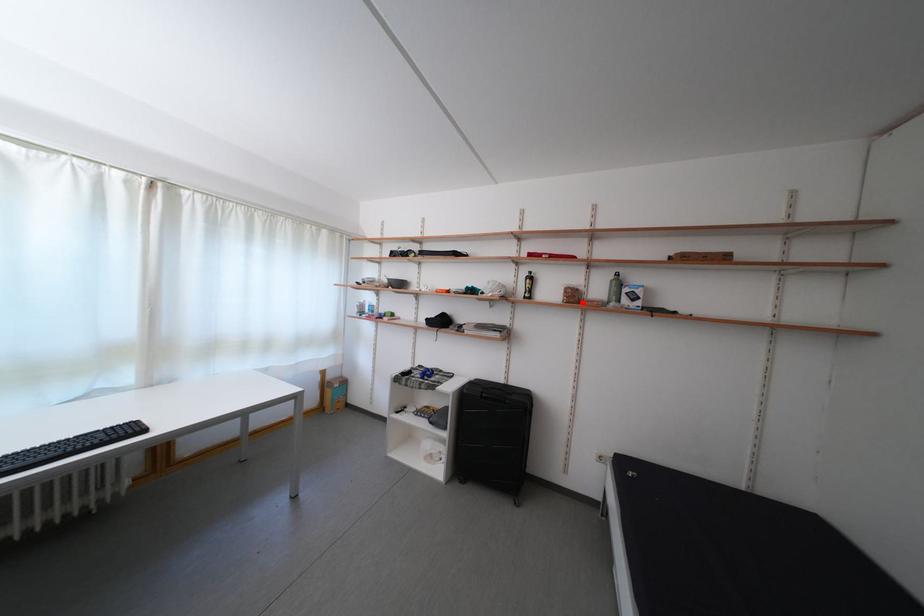
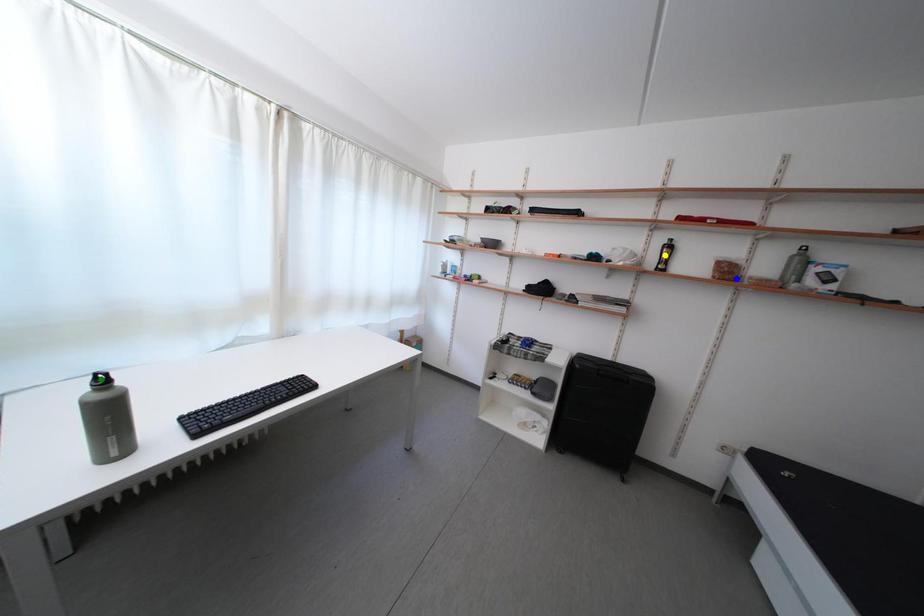
Question: I am providing you with two images of the same scene from different viewpoints. A red point is marked on the first image. You are given multiple points on the second image. Which point in image 2 represents the same 3d spot as the red point in image 1?

Choices:
 (A) green point
 (B) yellow point
 (C) blue point

Answer: (C)